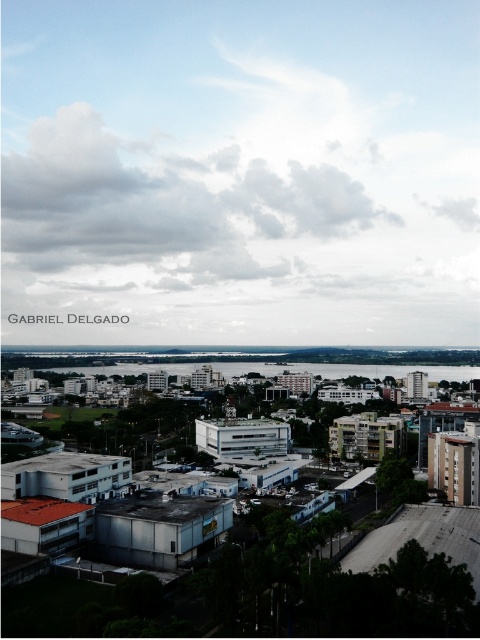
Question: Among these objects, which one is nearest to the camera?

Choices:
 (A) cloudy sky at upper center
 (B) clear water at center

Answer: (B)

Question: Is cloudy sky at upper center closer to camera compared to clear water at center?

Choices:
 (A) no
 (B) yes

Answer: (A)

Question: Does cloudy sky at upper center appear on the right side of clear water at center?

Choices:
 (A) yes
 (B) no

Answer: (B)

Question: Among these points, which one is nearest to the camera?

Choices:
 (A) tap(339, 188)
 (B) tap(58, 369)

Answer: (B)

Question: Can you confirm if cloudy sky at upper center is positioned to the left of clear water at center?

Choices:
 (A) yes
 (B) no

Answer: (A)

Question: Among these points, which one is farthest from the camera?

Choices:
 (A) (35, 81)
 (B) (84, 372)

Answer: (A)